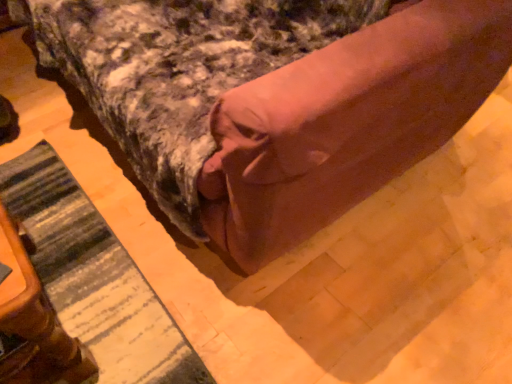
Question: Is brown fabric bed at center at the left side of striped fabric mat at lower left?

Choices:
 (A) no
 (B) yes

Answer: (A)

Question: Is brown fabric bed at center positioned far away from striped fabric mat at lower left?

Choices:
 (A) yes
 (B) no

Answer: (B)

Question: Considering the relative sizes of brown fabric bed at center and striped fabric mat at lower left in the image provided, is brown fabric bed at center taller than striped fabric mat at lower left?

Choices:
 (A) yes
 (B) no

Answer: (A)

Question: Is striped fabric mat at lower left located within brown fabric bed at center?

Choices:
 (A) no
 (B) yes

Answer: (A)

Question: Considering the relative sizes of brown fabric bed at center and striped fabric mat at lower left in the image provided, is brown fabric bed at center smaller than striped fabric mat at lower left?

Choices:
 (A) yes
 (B) no

Answer: (B)

Question: Is striped fabric mat at lower left in front of or behind wooden table at lower left in the image?

Choices:
 (A) front
 (B) behind

Answer: (B)

Question: Based on their positions, is striped fabric mat at lower left located to the left or right of wooden table at lower left?

Choices:
 (A) left
 (B) right

Answer: (B)

Question: Is striped fabric mat at lower left wider or thinner than wooden table at lower left?

Choices:
 (A) wide
 (B) thin

Answer: (A)

Question: From the image's perspective, relative to wooden table at lower left, is striped fabric mat at lower left above or below?

Choices:
 (A) below
 (B) above

Answer: (A)

Question: In the image, is striped fabric mat at lower left positioned in front of or behind brown fabric bed at center?

Choices:
 (A) behind
 (B) front

Answer: (A)

Question: Considering the positions of striped fabric mat at lower left and brown fabric bed at center in the image, is striped fabric mat at lower left wider or thinner than brown fabric bed at center?

Choices:
 (A) thin
 (B) wide

Answer: (A)

Question: From a real-world perspective, relative to brown fabric bed at center, is striped fabric mat at lower left vertically above or below?

Choices:
 (A) above
 (B) below

Answer: (B)

Question: From the image's perspective, is striped fabric mat at lower left above or below brown fabric bed at center?

Choices:
 (A) above
 (B) below

Answer: (B)

Question: Is point (17, 274) closer or farther from the camera than point (434, 26)?

Choices:
 (A) farther
 (B) closer

Answer: (B)

Question: Visually, is wooden table at lower left positioned to the left or to the right of brown fabric bed at center?

Choices:
 (A) right
 (B) left

Answer: (B)